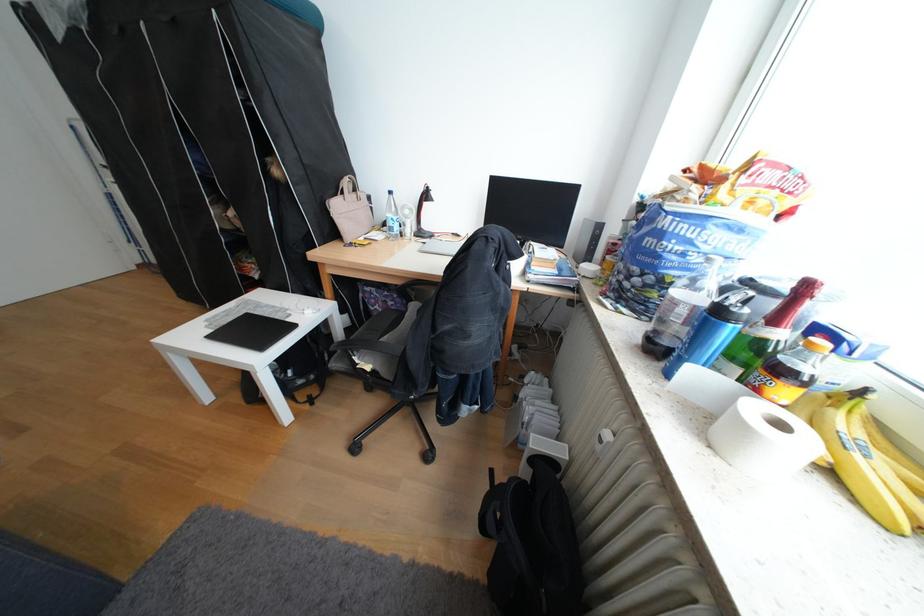
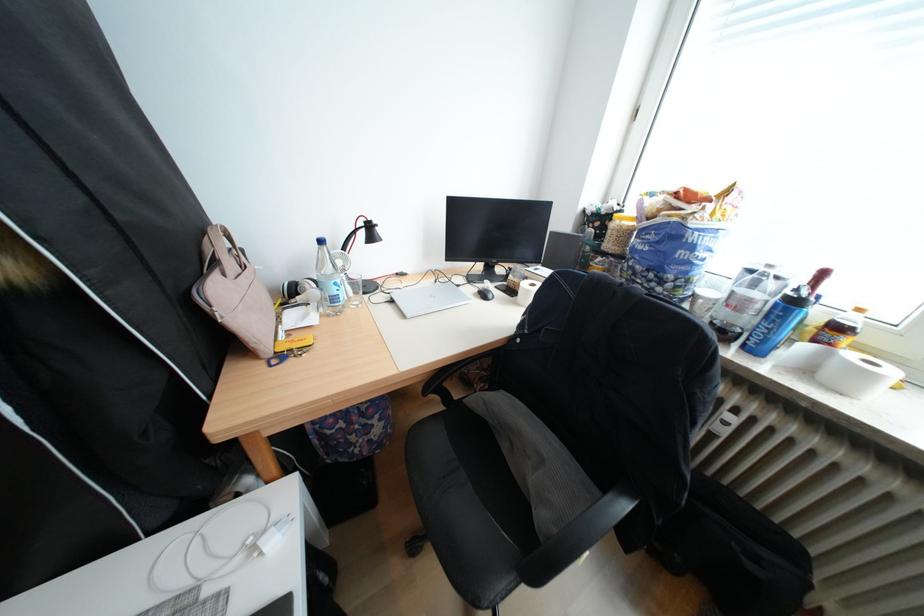
Where in the second image is the point corresponding to point (404, 230) from the first image?

(346, 300)